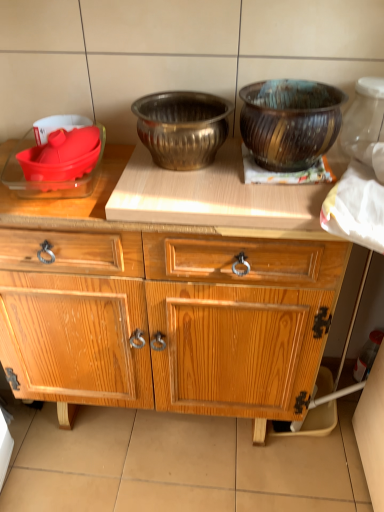
You are a GUI agent. You are given a task and a screenshot of the screen. Output one action in this format:
    pyautogui.click(x=<x>, y=<y>)
    Task: Click on the free space in front of matte red bowl at left, placed as the third bowl when sorted from right to left
    This screenshot has height=512, width=384.
    Given the screenshot: What is the action you would take?
    pyautogui.click(x=56, y=205)